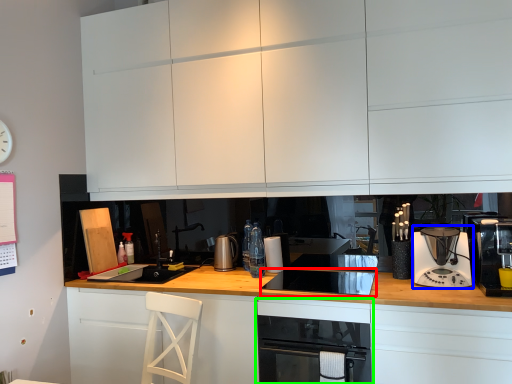
Question: Estimate the real-world distances between objects in this image. Which object is closer to appliance (highlighted by a red box), kitchen appliance (highlighted by a blue box) or home appliance (highlighted by a green box)?

Choices:
 (A) kitchen appliance
 (B) home appliance

Answer: (B)